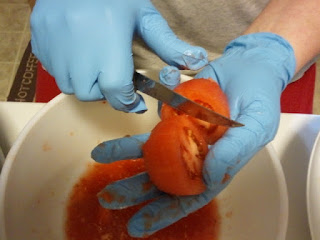
Locate an element on the screen. Image resolution: width=320 pixels, height=240 pixels. bowl is located at coordinates (262, 205), (200, 223).